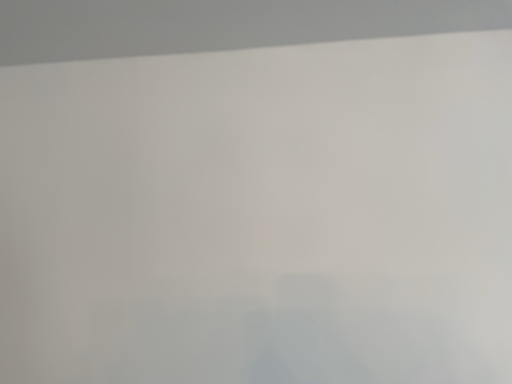
Locate an element on the screen. The image size is (512, 384). white matte wall at upper center is located at coordinates (x=221, y=24).

What do you see at coordinates (221, 24) in the screenshot? The width and height of the screenshot is (512, 384). I see `white matte wall at upper center` at bounding box center [221, 24].

Measure the distance between point (283, 23) and camera.

They are 1.00 meters apart.

Locate an element on the screen. white matte wall at upper center is located at coordinates (221, 24).